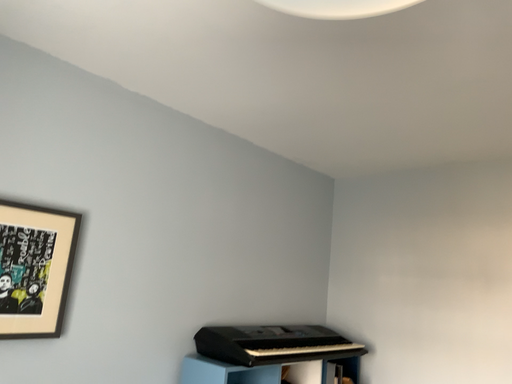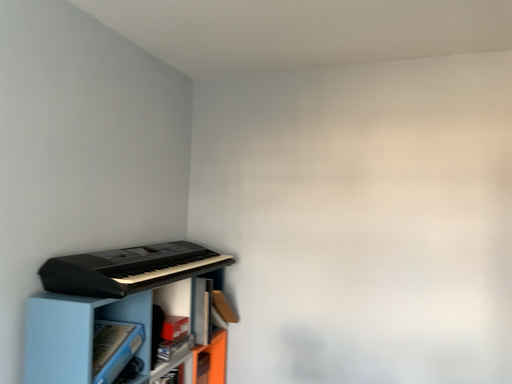
Question: How did the camera likely rotate when shooting the video?

Choices:
 (A) rotated right
 (B) rotated left

Answer: (A)